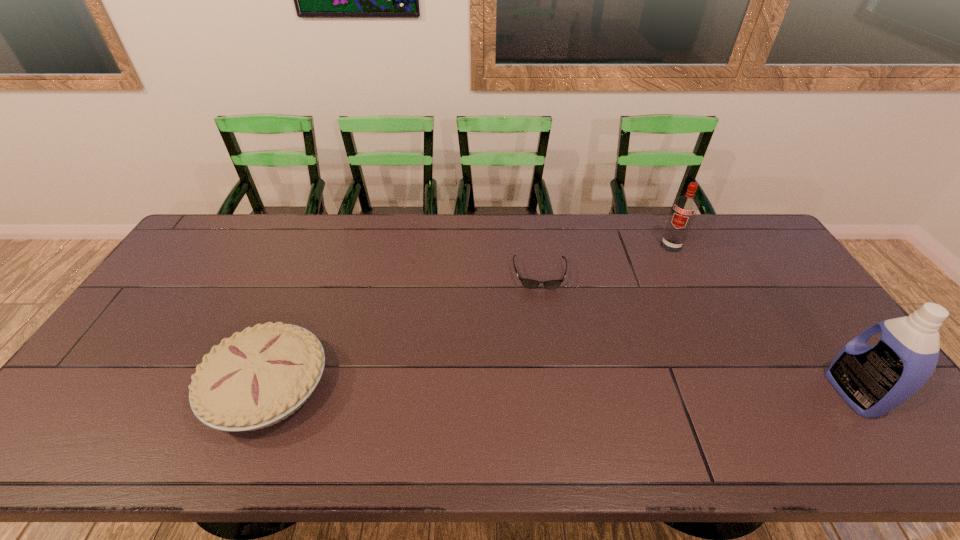
Where is `the leftmost object`? The width and height of the screenshot is (960, 540). the leftmost object is located at coordinates pos(256,378).

You are a GUI agent. You are given a task and a screenshot of the screen. Output one action in this format:
    pyautogui.click(x=<x>, y=<y>)
    Task: Click on the pie
    The width and height of the screenshot is (960, 540).
    Given the screenshot: What is the action you would take?
    pyautogui.click(x=256, y=378)

What are the coordinates of `detergent` in the screenshot? It's located at (873, 380).

The width and height of the screenshot is (960, 540). I want to click on the rightmost object, so click(x=873, y=380).

You are a GUI agent. You are given a task and a screenshot of the screen. Output one action in this format:
    pyautogui.click(x=<x>, y=<y>)
    Task: Click on the third object from left to right
    The height and width of the screenshot is (540, 960).
    Given the screenshot: What is the action you would take?
    pyautogui.click(x=684, y=209)

What are the coordinates of `the farthest object` in the screenshot? It's located at (684, 209).

Identify the location of sunglasses. (528, 283).

At what (x,y) coordinates should I click in order to perform the action: click on the shortest object. Please return your answer as a coordinate pair (x, y). Looking at the image, I should click on (528, 283).

This screenshot has height=540, width=960. Identify the location of vacant space located 0.290m on the back of the pie. (316, 269).

This screenshot has height=540, width=960. Identify the location of vacant space positioned 0.340m on the left of the rightmost object. (699, 393).